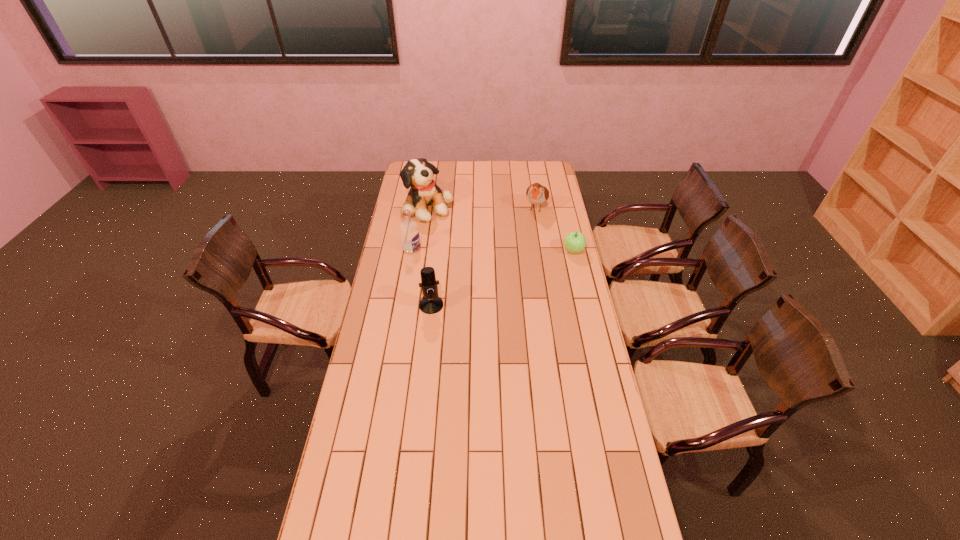
Image resolution: width=960 pixels, height=540 pixels. Identify the location of bird positioned at the right edge. (537, 194).

What are the coordinates of `free space at the far edge of the desktop` in the screenshot? It's located at (468, 168).

In order to click on blank space at the left edge in this screenshot , I will do `click(390, 252)`.

In the image, there is a desktop. What are the coordinates of `vacant area at the right edge` in the screenshot? It's located at (547, 244).

The image size is (960, 540). I want to click on vacant region between the fourth object from left to right and the apple, so click(x=555, y=229).

Identify the location of vacant area between the microphone and the second object from right to left. Image resolution: width=960 pixels, height=540 pixels. (484, 256).

Identify the location of vacant space in between the nearest object and the rightmost object. Image resolution: width=960 pixels, height=540 pixels. (502, 278).

Where is `empty location between the puppy and the rightmost object`? The image size is (960, 540). empty location between the puppy and the rightmost object is located at coordinates (501, 229).

The image size is (960, 540). In order to click on empty location between the puppy and the microphone in this screenshot , I will do `click(430, 256)`.

Locate an element on the screen. The image size is (960, 540). free space between the second object from right to left and the vodka is located at coordinates (474, 228).